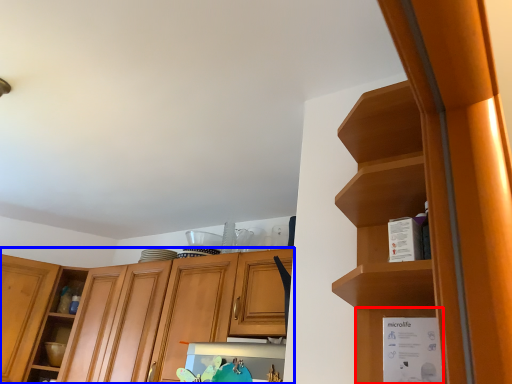
Question: Which of the following is the farthest to the observer, cabinet (highlighted by a red box) or cabinetry (highlighted by a blue box)?

Choices:
 (A) cabinet
 (B) cabinetry

Answer: (B)